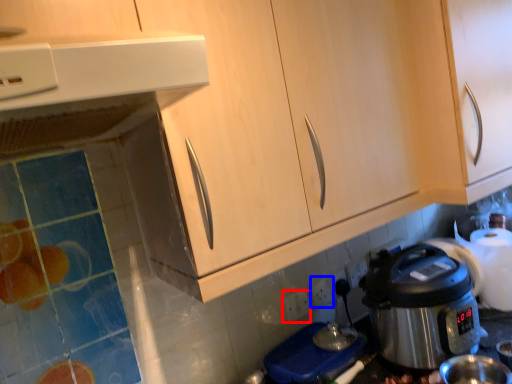
Question: Which object appears farthest to the camera in this image, power outlet (highlighted by a red box) or electric outlet (highlighted by a blue box)?

Choices:
 (A) power outlet
 (B) electric outlet

Answer: (B)